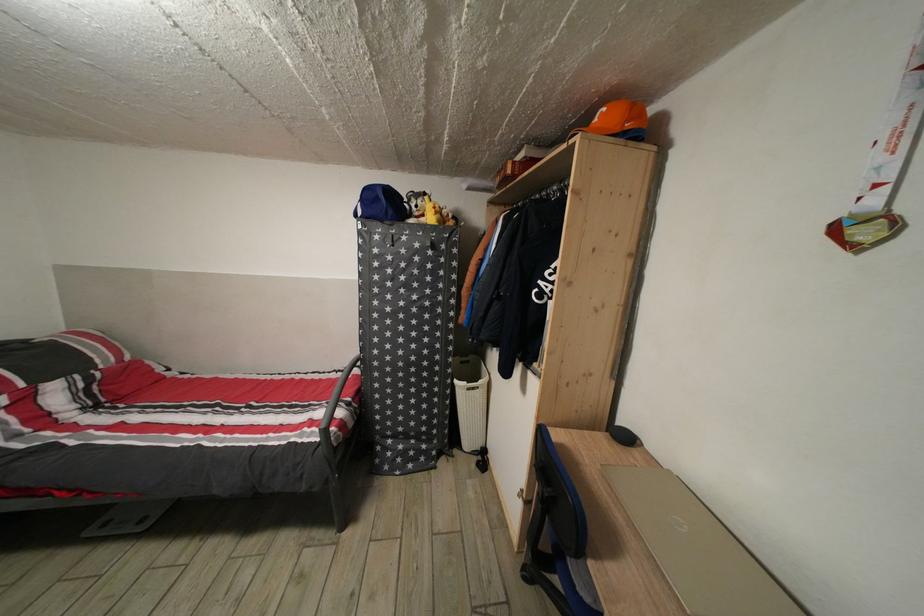
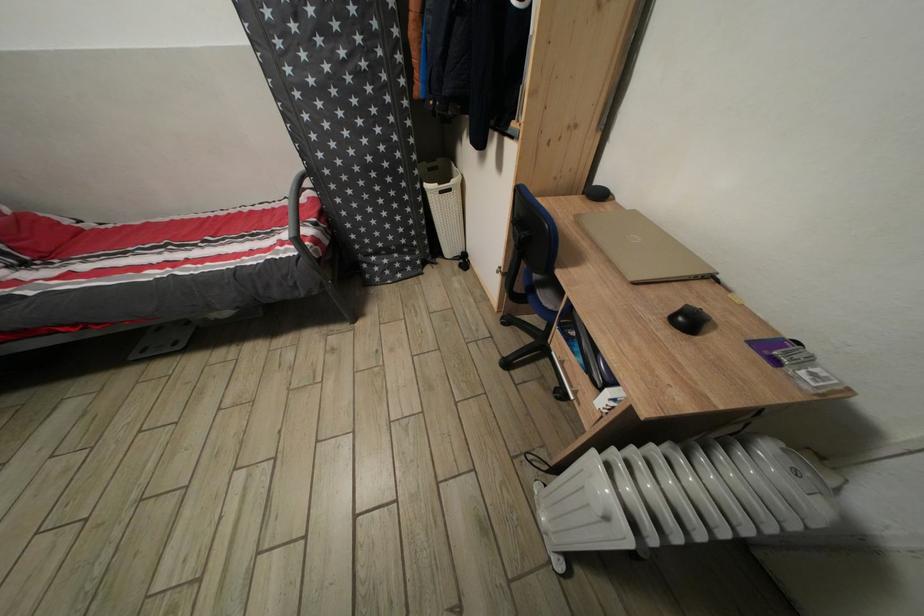
In the second image, find the point that corresponds to (463,387) in the first image.

(432, 192)